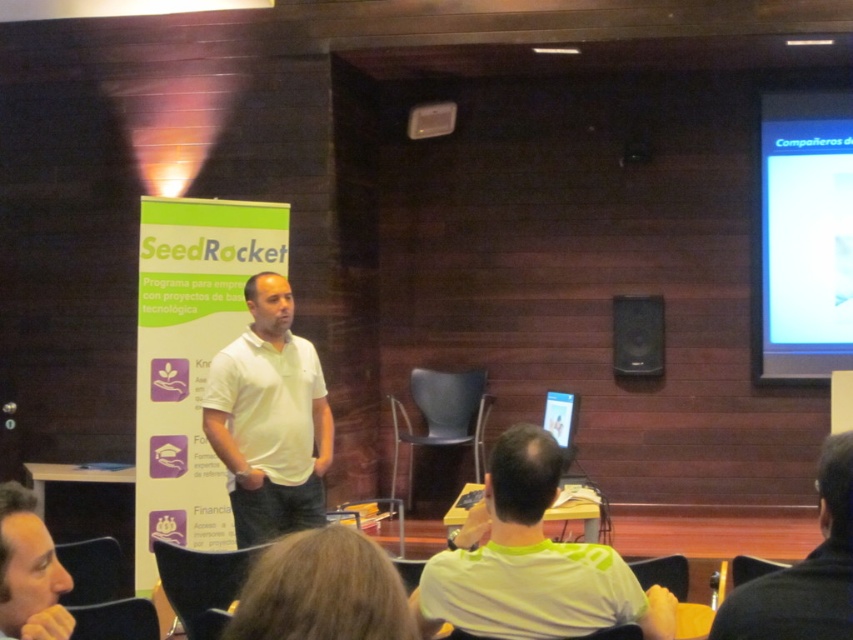
Can you confirm if matte white projector screen at upper right is bigger than black plastic speaker at upper center?

Indeed, matte white projector screen at upper right has a larger size compared to black plastic speaker at upper center.

The image size is (853, 640). In order to click on matte white projector screen at upper right in this screenshot , I will do `click(804, 236)`.

The height and width of the screenshot is (640, 853). In order to click on matte white projector screen at upper right in this screenshot , I will do `click(804, 236)`.

Who is higher up, yellow matte shirt at center or white matte shirt at center?

Positioned higher is white matte shirt at center.

Which is in front, point (648, 618) or point (282, 372)?

Point (648, 618)

The width and height of the screenshot is (853, 640). What do you see at coordinates (531, 563) in the screenshot? I see `yellow matte shirt at center` at bounding box center [531, 563].

Locate an element on the screen. The width and height of the screenshot is (853, 640). yellow matte shirt at center is located at coordinates (531, 563).

Is yellow matte shirt at center to the right of matte white projector screen at upper right from the viewer's perspective?

Incorrect, yellow matte shirt at center is not on the right side of matte white projector screen at upper right.

How far apart are yellow matte shirt at center and matte white projector screen at upper right?

The distance of yellow matte shirt at center from matte white projector screen at upper right is 4.58 meters.

You are a GUI agent. You are given a task and a screenshot of the screen. Output one action in this format:
    pyautogui.click(x=<x>, y=<y>)
    Task: Click on the yellow matte shirt at center
    This screenshot has height=640, width=853.
    Given the screenshot: What is the action you would take?
    pyautogui.click(x=531, y=563)

At what (x,y) coordinates should I click in order to perform the action: click on yellow matte shirt at center. Please return your answer as a coordinate pair (x, y). Looking at the image, I should click on (531, 563).